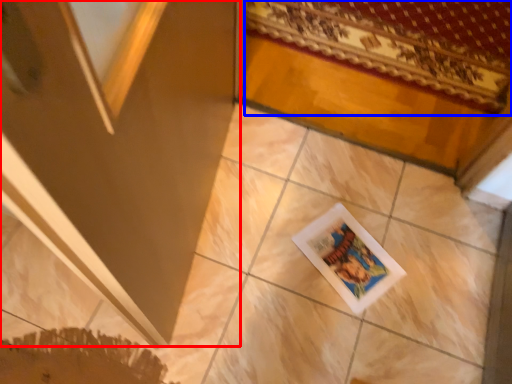
Question: Which of the following is the closest to the observer, screen door (highlighted by a red box) or mat (highlighted by a blue box)?

Choices:
 (A) screen door
 (B) mat

Answer: (A)